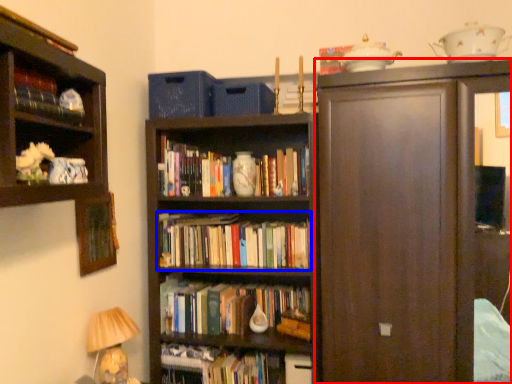
Question: Which object appears closest to the camera in this image, cupboard (highlighted by a red box) or book (highlighted by a blue box)?

Choices:
 (A) cupboard
 (B) book

Answer: (A)